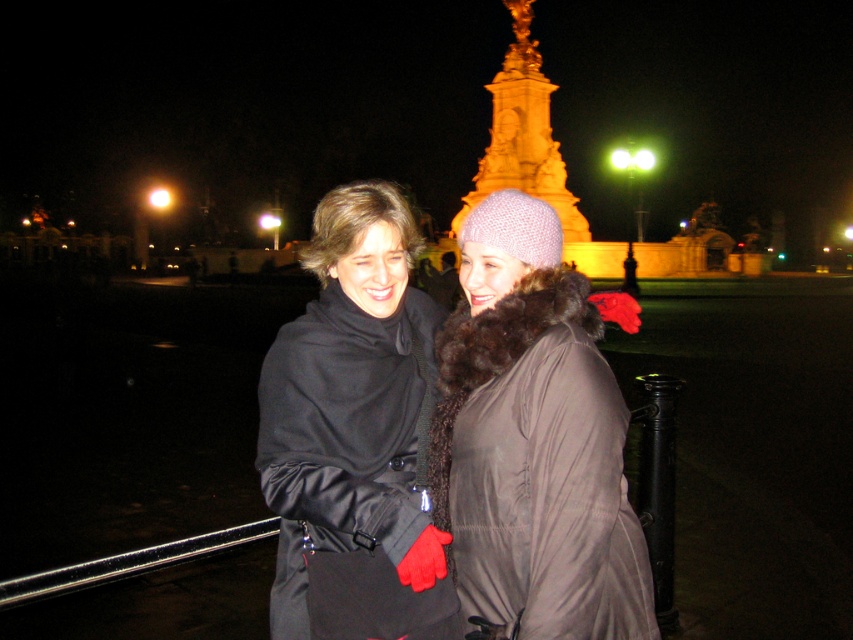
Question: Among these points, which one is farthest from the camera?

Choices:
 (A) (286, 381)
 (B) (444, 344)

Answer: (B)

Question: Is matte black coat at center below gold polished stone tower at upper center?

Choices:
 (A) no
 (B) yes

Answer: (B)

Question: Can you confirm if matte black coat at center is positioned below gold polished stone tower at upper center?

Choices:
 (A) no
 (B) yes

Answer: (B)

Question: Estimate the real-world distances between objects in this image. Which object is farther from the matte black coat at center?

Choices:
 (A) gold polished stone tower at upper center
 (B) knitted woolen hat at center

Answer: (A)

Question: Is knitted woolen hat at center positioned at the back of gold polished stone tower at upper center?

Choices:
 (A) yes
 (B) no

Answer: (B)

Question: Which of the following is the farthest from the observer?

Choices:
 (A) gold polished stone tower at upper center
 (B) matte black coat at center

Answer: (A)